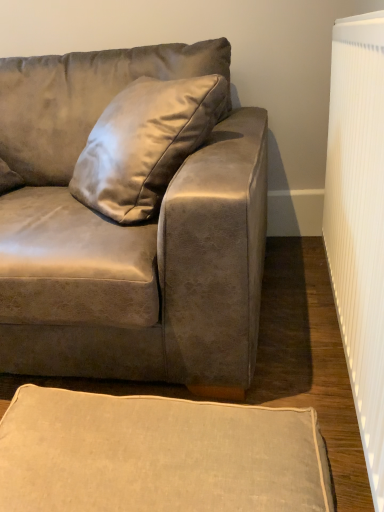
Where is `suede couch at left`? The width and height of the screenshot is (384, 512). suede couch at left is located at coordinates (129, 234).

What do you see at coordinates (129, 234) in the screenshot? I see `suede couch at left` at bounding box center [129, 234].

The height and width of the screenshot is (512, 384). Find the location of `suede couch at left`. suede couch at left is located at coordinates (129, 234).